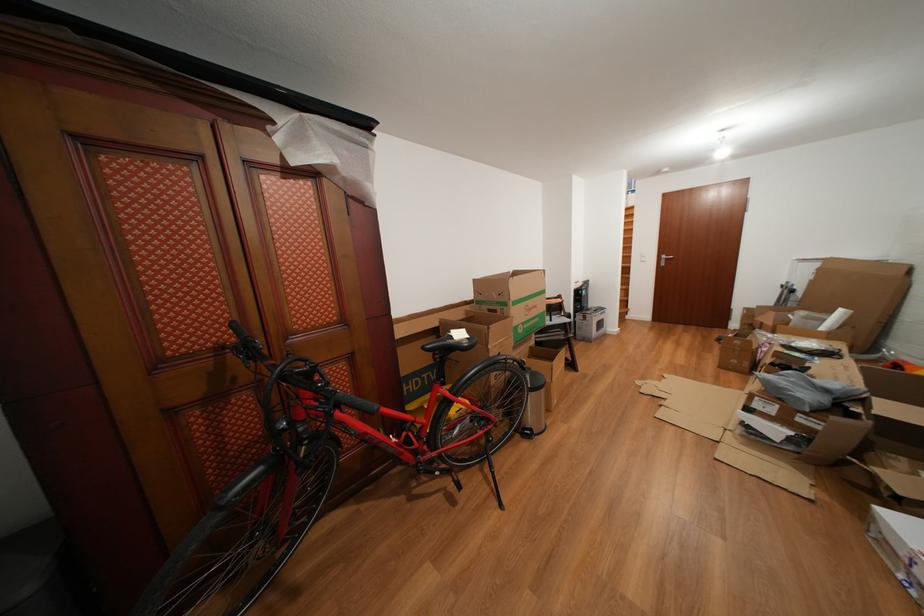
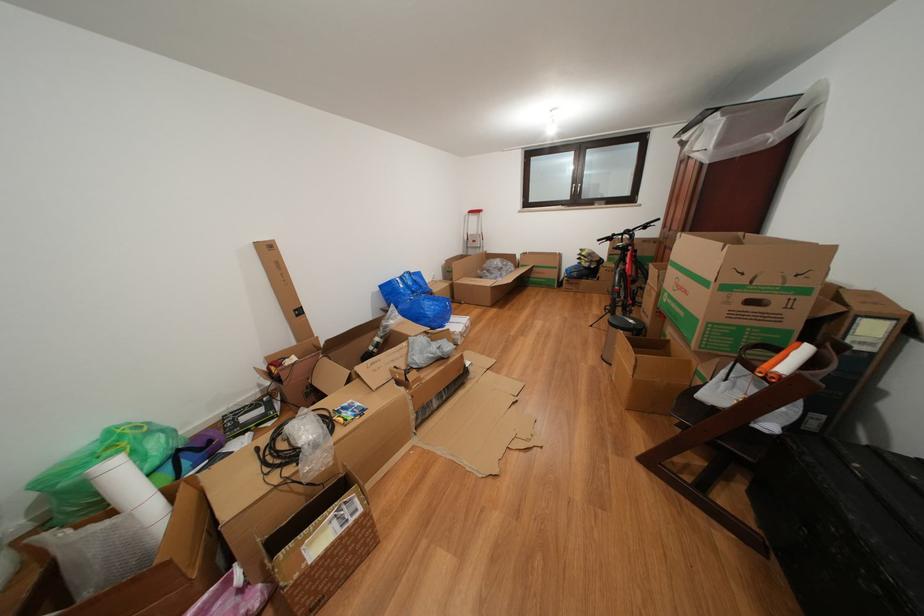
Locate, in the second image, the point that corresponds to point 543,312 in the first image.

(694, 297)